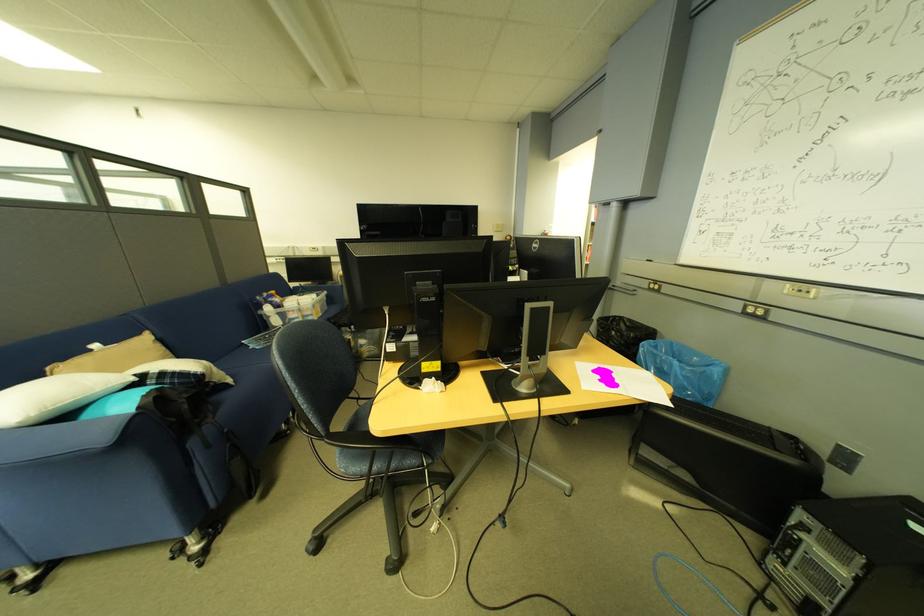
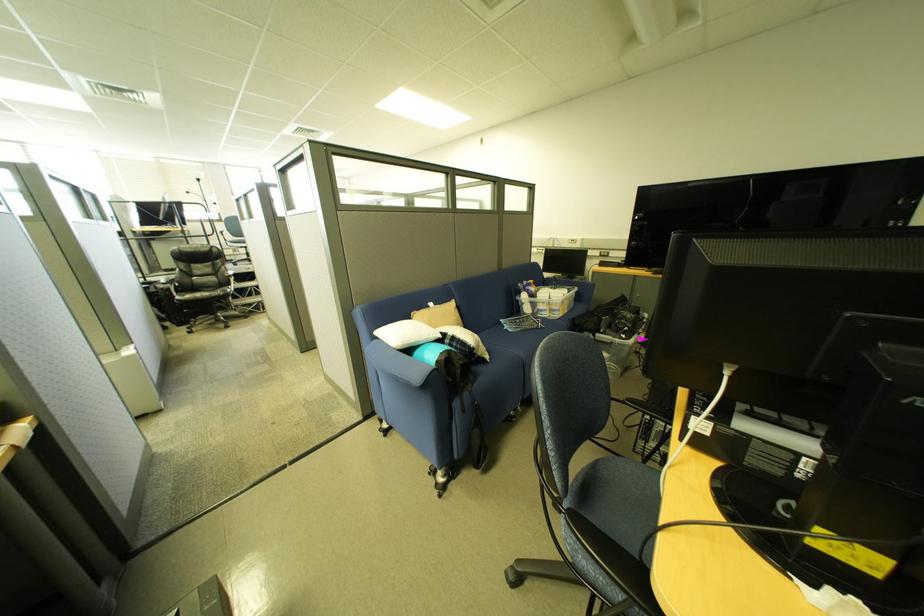
Find the pixel in the second image that matches (273,317) in the first image.

(529, 302)